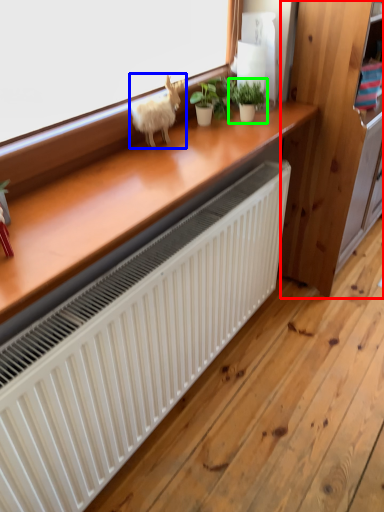
Question: Based on their relative distances, which object is farther from dresser (highlighted by a red box)? Choose from animal (highlighted by a blue box) and houseplant (highlighted by a green box).

Choices:
 (A) animal
 (B) houseplant

Answer: (A)